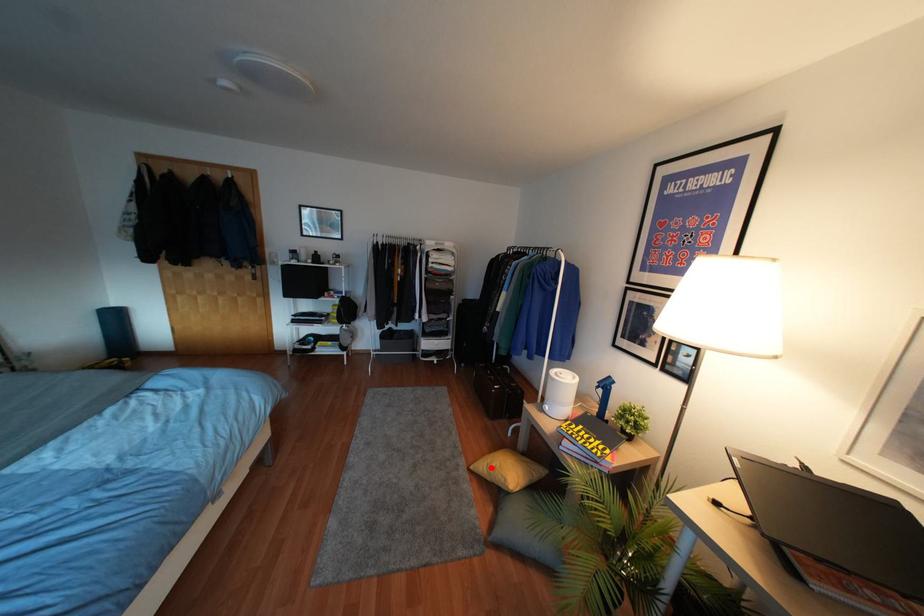
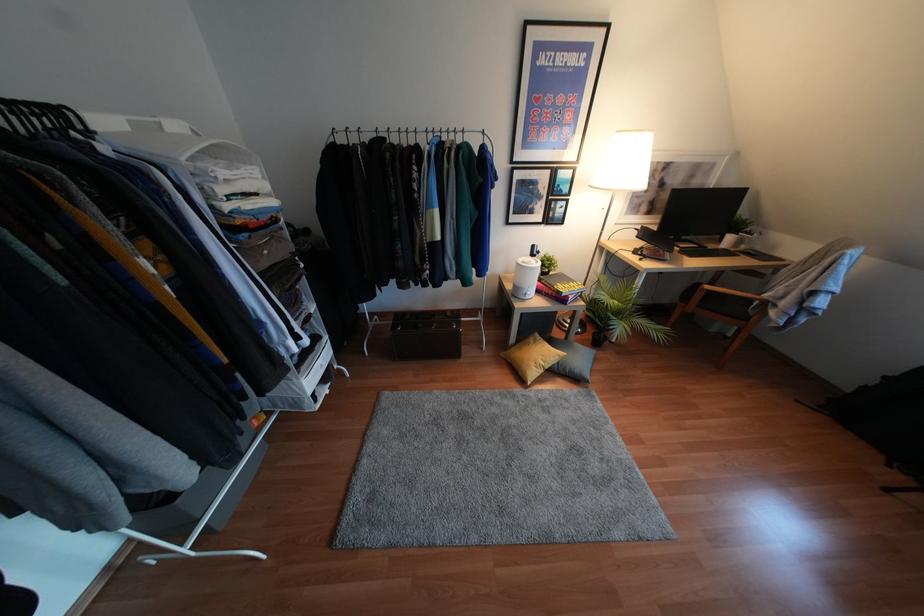
The point at the highlighted location is marked in the first image. Where is the corresponding point in the second image?

(541, 363)